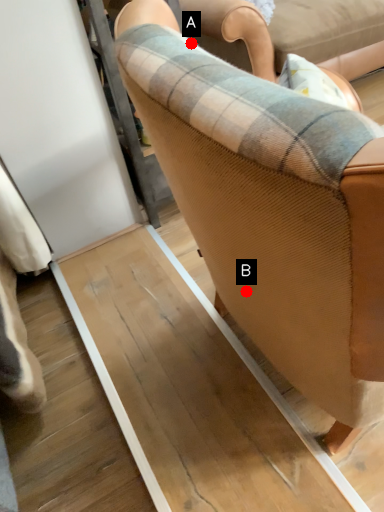
Question: Two points are circled on the image, labeled by A and B beside each circle. Among these points, which one is farthest from the camera?

Choices:
 (A) A is further
 (B) B is further

Answer: (B)